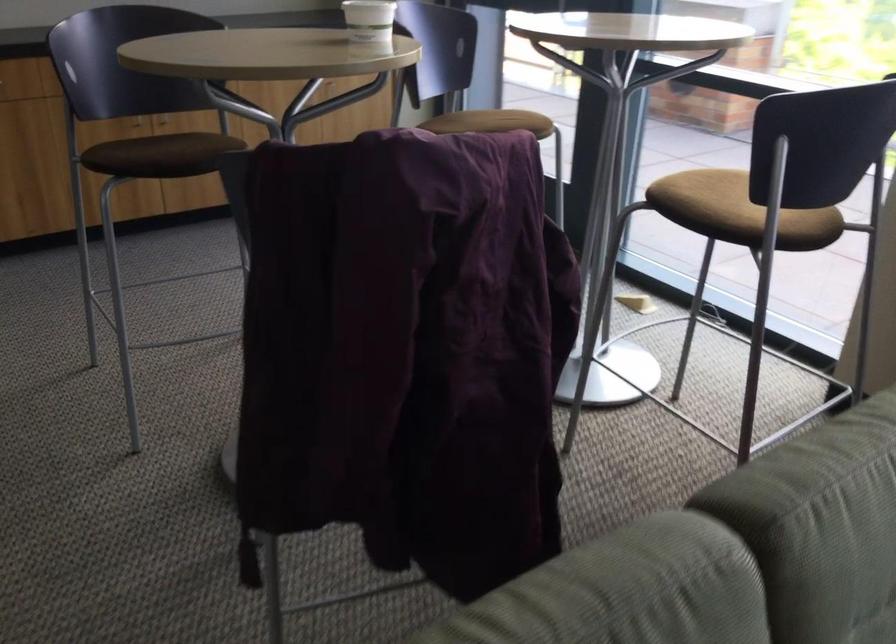
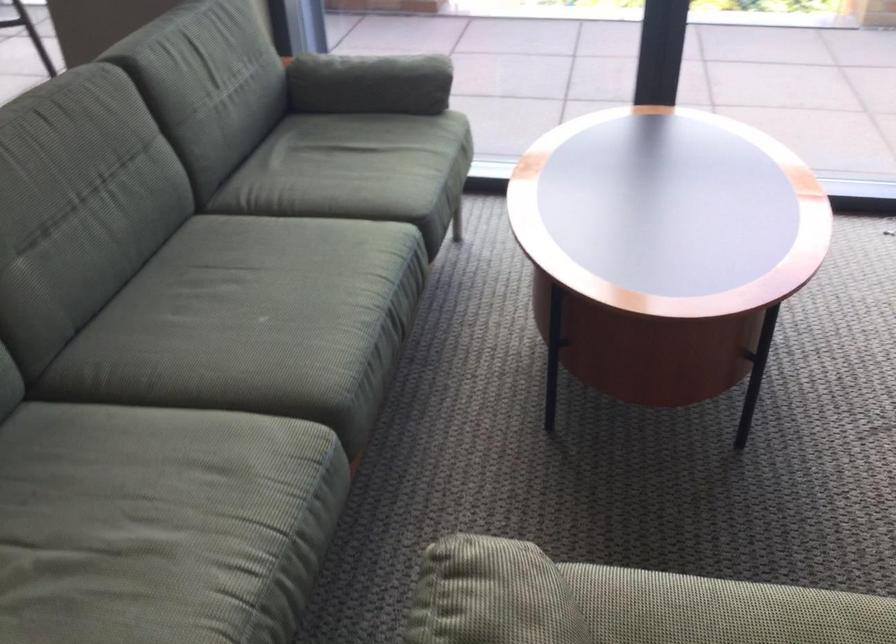
Question: How did the camera likely rotate?

Choices:
 (A) Left
 (B) Right
 (C) Up
 (D) Down

Answer: (B)